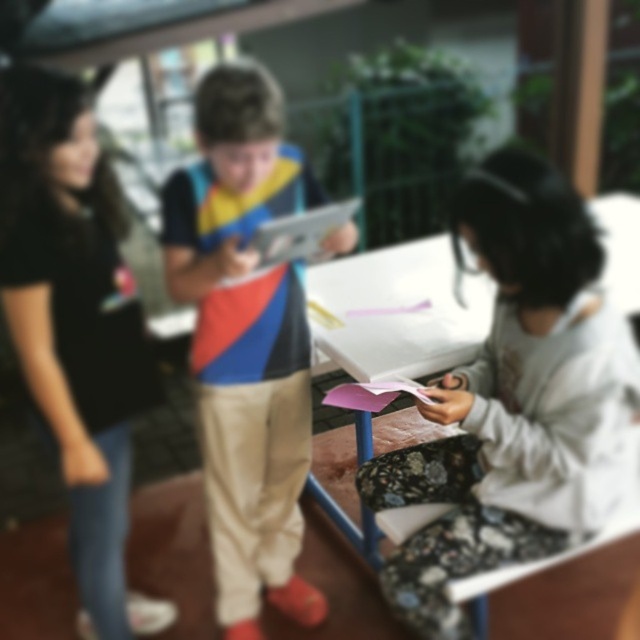
You are a photographer trying to capture a clear shot of the black matte shirt at left and the fluffy white hoodie at lower right. Which one is positioned lower in the frame?

The fluffy white hoodie at lower right is positioned lower in the frame than the black matte shirt at left.

You are a delivery robot that is 1.2 meters tall. You need to deliver a package to the fluffy white hoodie at lower right. The path to them is blocked by a low table that is 0.8 meters high. Can you go under the table to reach them?

The low table is 0.8 meters high. Since the robot is 1.2 meters tall, it cannot go under the table because the table is too low, but the robot is taller than the table height. Therefore, the robot cannot pass under the table to reach the fluffy white hoodie at lower right.

Where is the matte plastic tablet at center located in the image?

The matte plastic tablet at center is located at point [244,340] in the image.